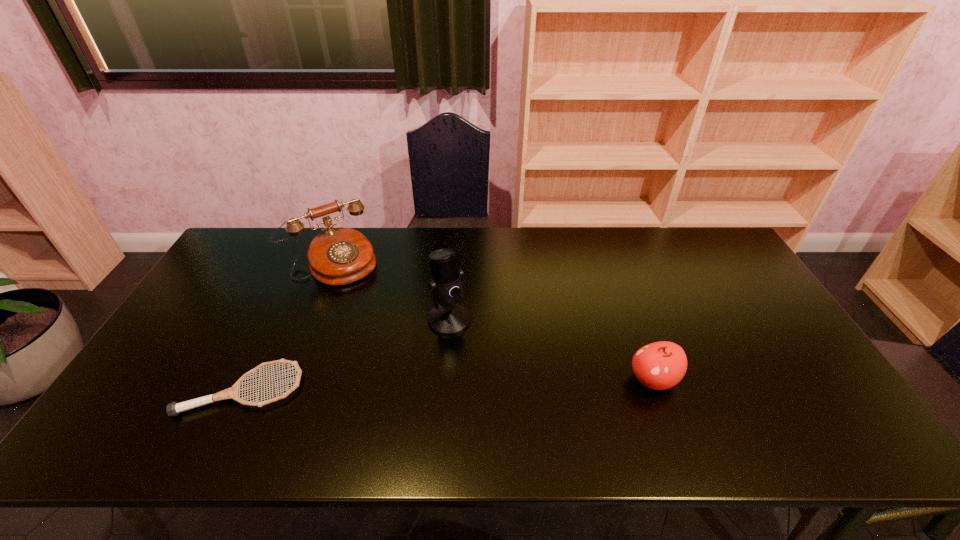
In order to click on vacant space that satisfies the following two spatial constraints: 1. on the front side of the third shortest object; 2. on the right side of the tallest object in this screenshot , I will do `click(309, 320)`.

Identify the location of free space that satisfies the following two spatial constraints: 1. on the front side of the telephone; 2. on the left side of the third nearest object. (309, 320).